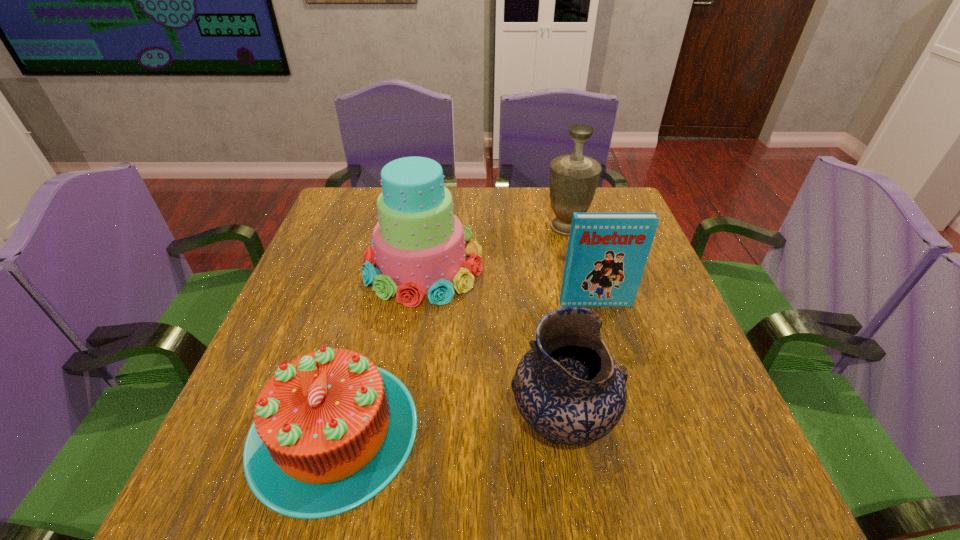
Find the location of a particular element. This screenshot has height=540, width=960. vacant space situated on the right of the nearer cake is located at coordinates (624, 430).

What are the coordinates of `urn that is at the far edge` in the screenshot? It's located at (574, 177).

At what (x,y) coordinates should I click in order to perform the action: click on cake at the far edge. Please return your answer as a coordinate pair (x, y). This screenshot has width=960, height=540. Looking at the image, I should click on (418, 246).

Where is `pottery that is at the near edge`? pottery that is at the near edge is located at coordinates (568, 388).

Locate an element on the screen. The image size is (960, 540). cake positioned at the near edge is located at coordinates (331, 430).

Where is `urn that is at the right edge`? The height and width of the screenshot is (540, 960). urn that is at the right edge is located at coordinates (574, 177).

Where is `book present at the right edge`? This screenshot has width=960, height=540. book present at the right edge is located at coordinates (607, 252).

Image resolution: width=960 pixels, height=540 pixels. Find the location of `object positioned at the far left corner`. object positioned at the far left corner is located at coordinates (418, 246).

Identify the location of object that is positioned at the near left corner. This screenshot has width=960, height=540. (331, 430).

You are a GUI agent. You are given a task and a screenshot of the screen. Output one action in this format:
    pyautogui.click(x=<x>, y=<y>)
    Task: Click on the object present at the far right corner
    Image resolution: width=960 pixels, height=540 pixels.
    Given the screenshot: What is the action you would take?
    pyautogui.click(x=574, y=177)